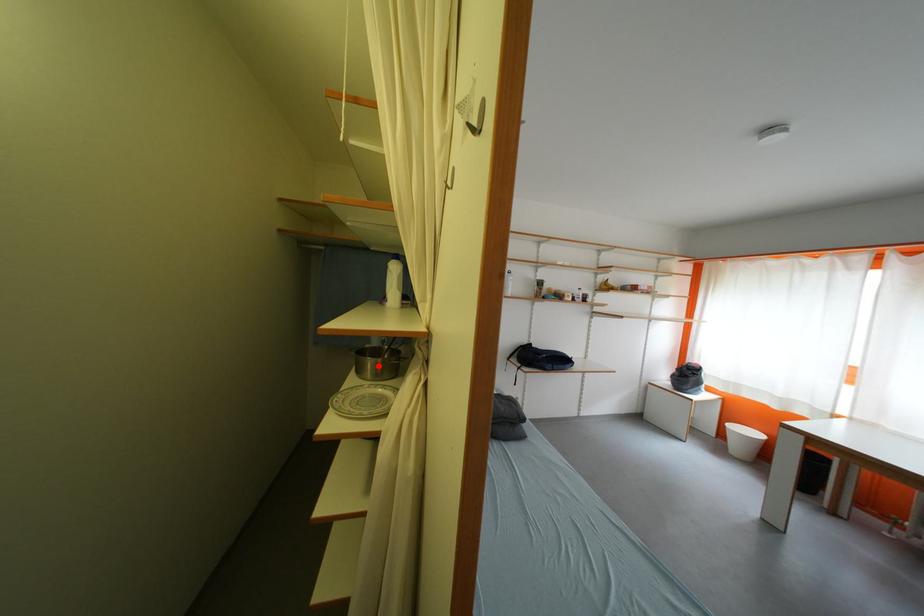
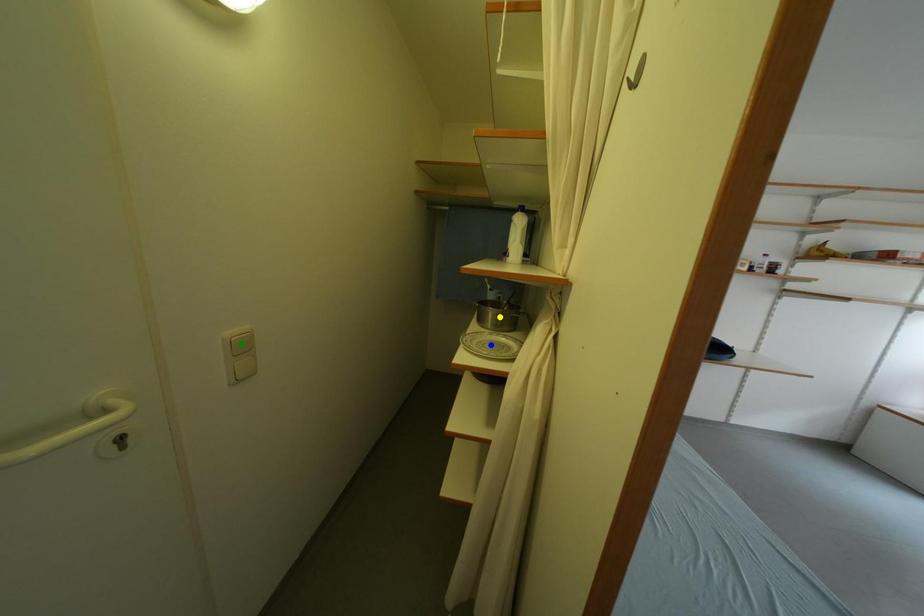
Question: I am providing you with two images of the same scene from different viewpoints. A red point is marked on the first image. You are given multiple points on the second image. Which spot in image 2 lines up with the point in image 1?

Choices:
 (A) green point
 (B) yellow point
 (C) blue point

Answer: (B)